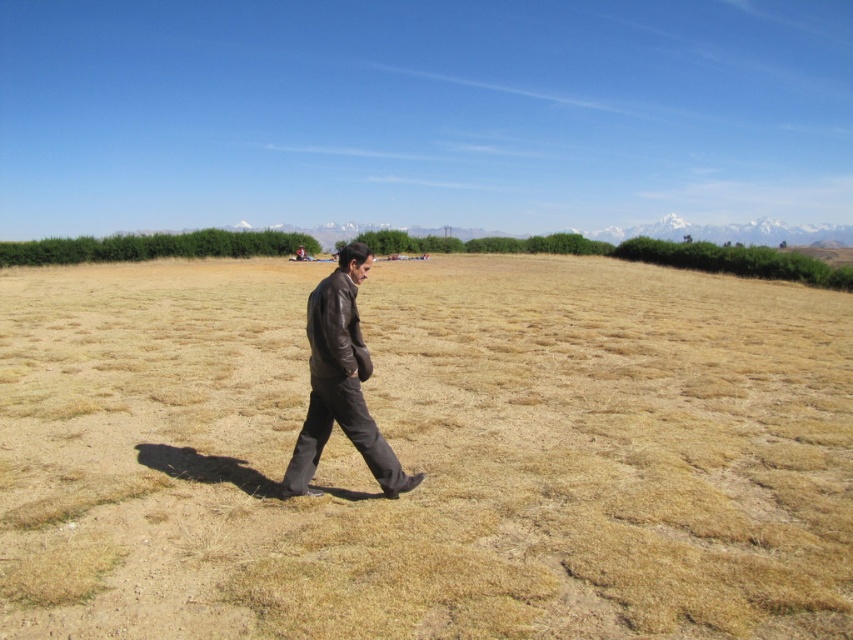
Question: Is brown grass at center thinner than brown leather jacket at center?

Choices:
 (A) no
 (B) yes

Answer: (A)

Question: Does brown grass at center have a lesser width compared to brown leather jacket at center?

Choices:
 (A) no
 (B) yes

Answer: (A)

Question: Which of the following is the farthest from the observer?

Choices:
 (A) brown leather jacket at center
 (B) brown grass at center

Answer: (A)

Question: Can you confirm if brown grass at center is positioned below brown leather jacket at center?

Choices:
 (A) no
 (B) yes

Answer: (A)

Question: Which of the following is the farthest from the observer?

Choices:
 (A) brown leather jacket at center
 (B) brown grass at center

Answer: (A)